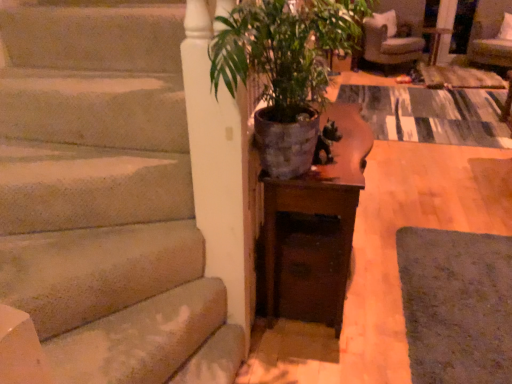
Question: Considering the relative sizes of green matte pot at center and velvet beige armchair at upper right in the image provided, is green matte pot at center thinner than velvet beige armchair at upper right?

Choices:
 (A) no
 (B) yes

Answer: (B)

Question: From the image's perspective, is green matte pot at center below velvet beige armchair at upper right?

Choices:
 (A) no
 (B) yes

Answer: (B)

Question: Would you say green matte pot at center is a long distance from velvet beige armchair at upper right?

Choices:
 (A) no
 (B) yes

Answer: (B)

Question: Is green matte pot at center wider than velvet beige armchair at upper right?

Choices:
 (A) yes
 (B) no

Answer: (B)

Question: From the image's perspective, would you say green matte pot at center is positioned over velvet beige armchair at upper right?

Choices:
 (A) no
 (B) yes

Answer: (A)

Question: Is point tap(438, 39) closer or farther from the camera than point tap(480, 49)?

Choices:
 (A) farther
 (B) closer

Answer: (B)

Question: Considering their positions, is wooden side table at center located in front of or behind velvet beige armchair at upper right?

Choices:
 (A) front
 (B) behind

Answer: (B)

Question: Is wooden side table at center spatially inside velvet beige armchair at upper right, or outside of it?

Choices:
 (A) inside
 (B) outside

Answer: (B)

Question: In terms of height, does wooden side table at center look taller or shorter compared to velvet beige armchair at upper right?

Choices:
 (A) tall
 (B) short

Answer: (B)

Question: In terms of size, does wooden table at center appear bigger or smaller than wooden side table at center?

Choices:
 (A) big
 (B) small

Answer: (A)

Question: Looking at their shapes, would you say wooden table at center is wider or thinner than wooden side table at center?

Choices:
 (A) wide
 (B) thin

Answer: (B)

Question: Which is correct: wooden table at center is inside wooden side table at center, or outside of it?

Choices:
 (A) outside
 (B) inside

Answer: (A)

Question: Is wooden table at center to the left or to the right of wooden side table at center in the image?

Choices:
 (A) left
 (B) right

Answer: (A)

Question: From their relative heights in the image, would you say wooden table at center is taller or shorter than beige fabric armchair at upper right?

Choices:
 (A) short
 (B) tall

Answer: (B)

Question: Would you say wooden table at center is inside or outside beige fabric armchair at upper right?

Choices:
 (A) outside
 (B) inside

Answer: (A)